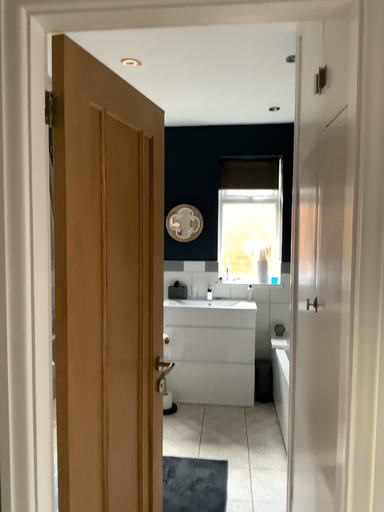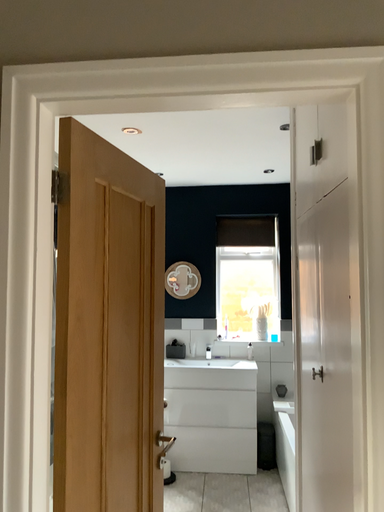
Question: How did the camera likely rotate when shooting the video?

Choices:
 (A) rotated upward
 (B) rotated downward

Answer: (A)